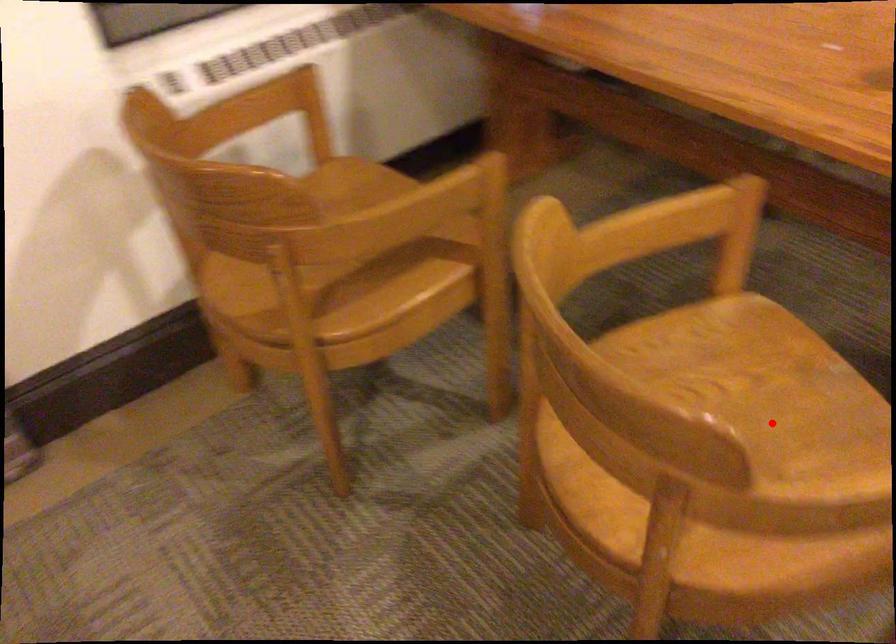
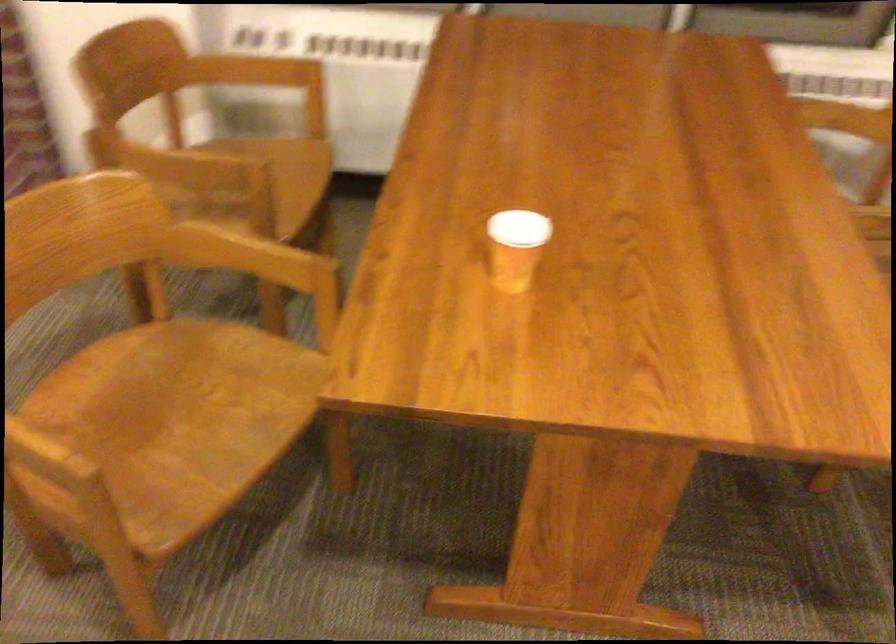
Question: A red point is marked in image1. In image2, is the corresponding 3D point closer to the camera or farther? Reply with the corresponding letter.

Choices:
 (A) The corresponding 3D point is closer.
 (B) The corresponding 3D point is farther.

Answer: (B)